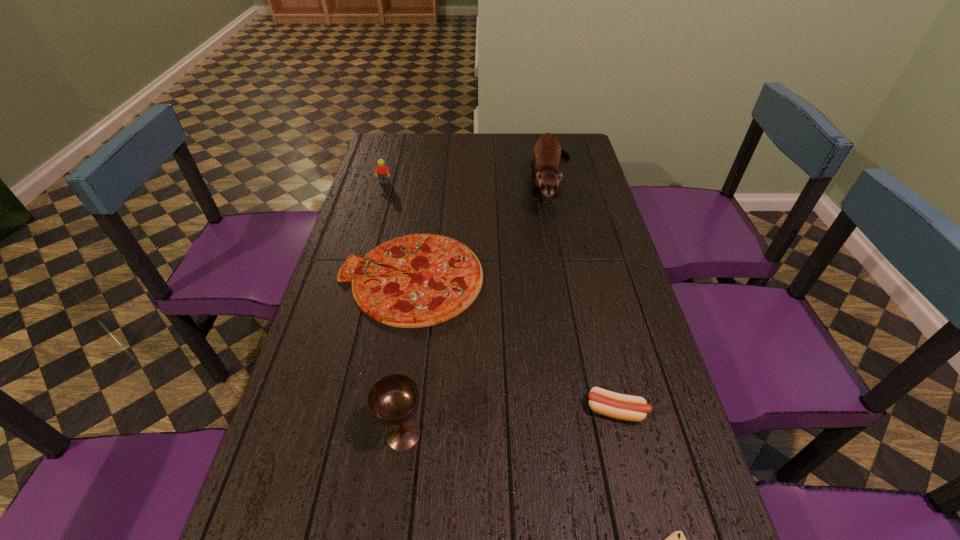
At what (x,y) coordinates should I click in order to perform the action: click on free space at the far left corner of the desktop. Please return your answer as a coordinate pair (x, y). This screenshot has height=540, width=960. Looking at the image, I should click on [401, 161].

Locate an element on the screen. Image resolution: width=960 pixels, height=540 pixels. free space between the ferret and the chalice is located at coordinates (478, 310).

The image size is (960, 540). What are the coordinates of `free spot between the fourth shortest object and the fourth nearest object` in the screenshot? It's located at (397, 230).

Find the location of a particular element. This screenshot has width=960, height=540. empty space between the third shortest object and the chalice is located at coordinates (510, 423).

Find the location of `free area in between the third farthest object and the chalice`. free area in between the third farthest object and the chalice is located at coordinates click(407, 356).

Image resolution: width=960 pixels, height=540 pixels. Identify the location of blank region between the fourth shortest object and the fourth tallest object. (500, 296).

The height and width of the screenshot is (540, 960). In order to click on free space between the second shortest object and the fourth tallest object in this screenshot , I will do `click(514, 344)`.

At what (x,y) coordinates should I click in order to perform the action: click on free space between the ferret and the chalice. Please return your answer as a coordinate pair (x, y). This screenshot has width=960, height=540. Looking at the image, I should click on (478, 310).

Locate an element on the screen. unoccupied position between the fourth tallest object and the Lego is located at coordinates (500, 296).

Identify the location of object that stands as the second closest to the ferret. [383, 173].